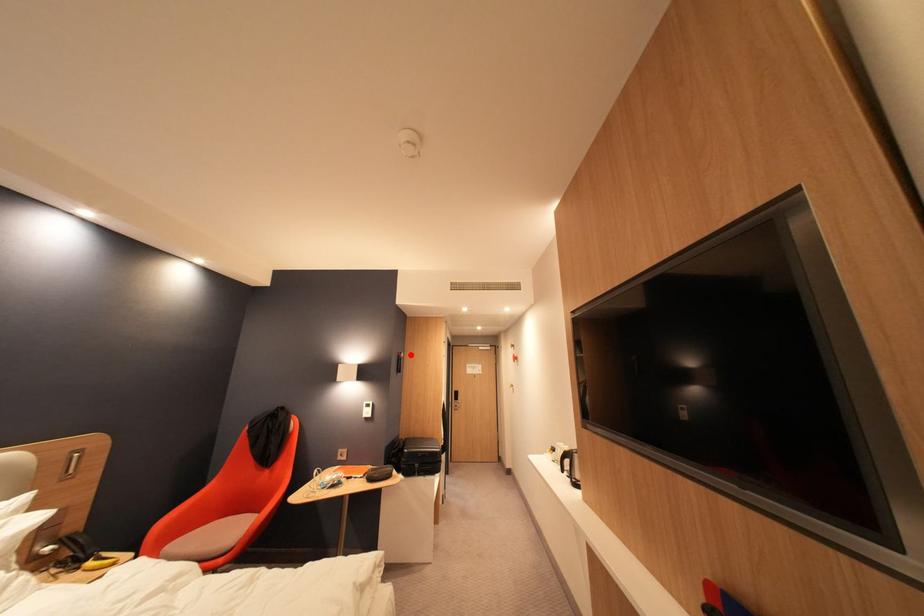
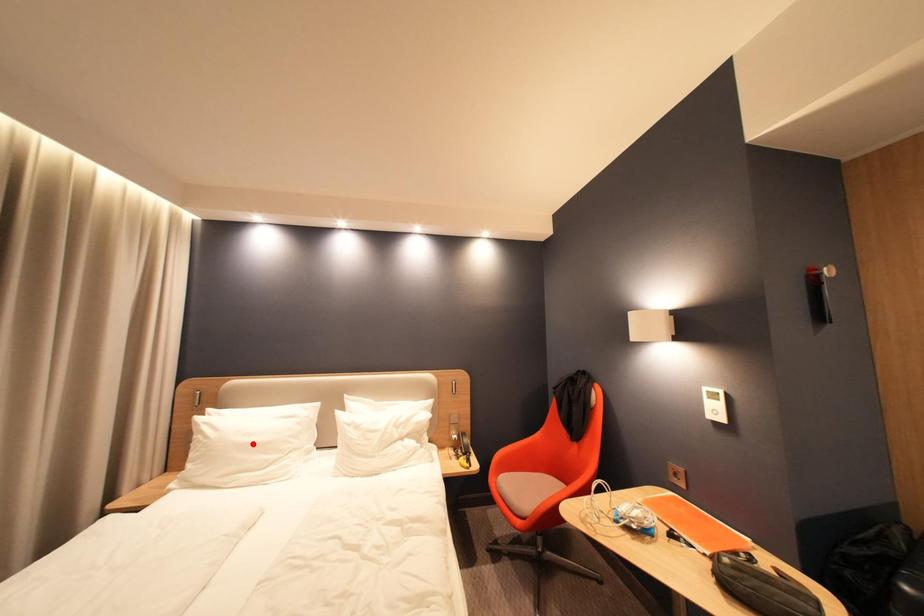
I am providing you with two images of the same scene from different viewpoints. A red point is marked on the first image and another point is marked on the second image. Is the red point in image1 aligned with the point shown in image2?

No